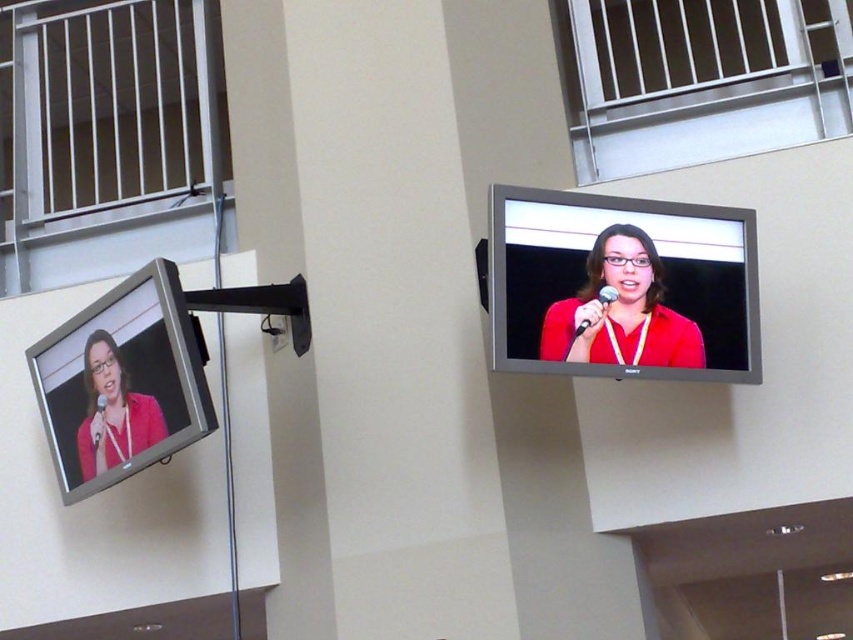
Question: Which object is the closest to the matte black monitor at upper right?

Choices:
 (A) matte red shirt at upper right
 (B) metallic white balcony at upper center
 (C) matte black screen at left

Answer: (A)

Question: Can you confirm if matte black monitor at upper right is thinner than metallic white balcony at upper center?

Choices:
 (A) yes
 (B) no

Answer: (A)

Question: Is matte black monitor at upper right positioned behind matte black monitor at left?

Choices:
 (A) yes
 (B) no

Answer: (A)

Question: Which point is closer to the camera?

Choices:
 (A) matte black monitor at upper right
 (B) matte black screen at left

Answer: (A)

Question: Can you confirm if metallic white balcony at upper center is wider than matte red shirt at upper right?

Choices:
 (A) no
 (B) yes

Answer: (B)

Question: Which object is the closest to the matte black screen at left?

Choices:
 (A) matte black monitor at upper right
 (B) matte red shirt at upper right

Answer: (A)